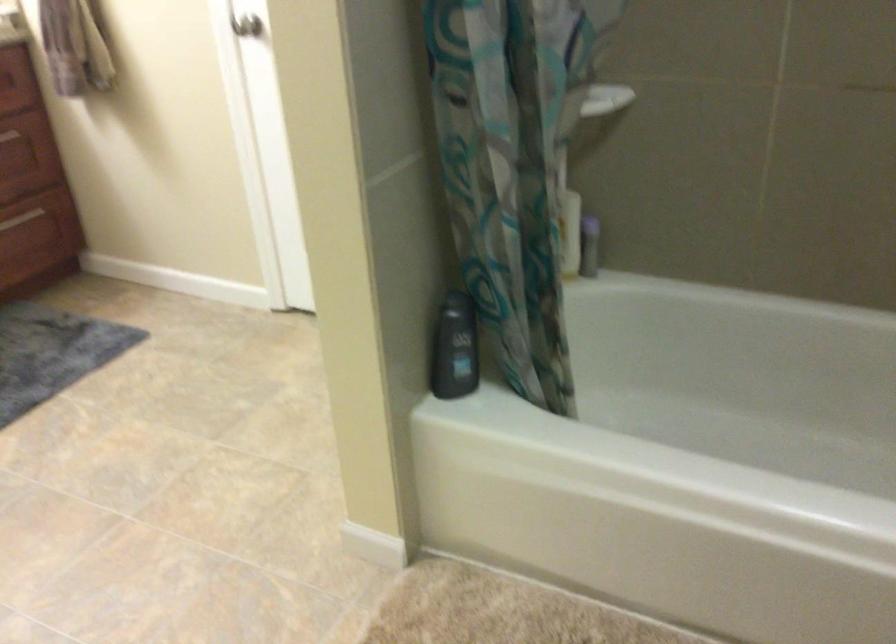
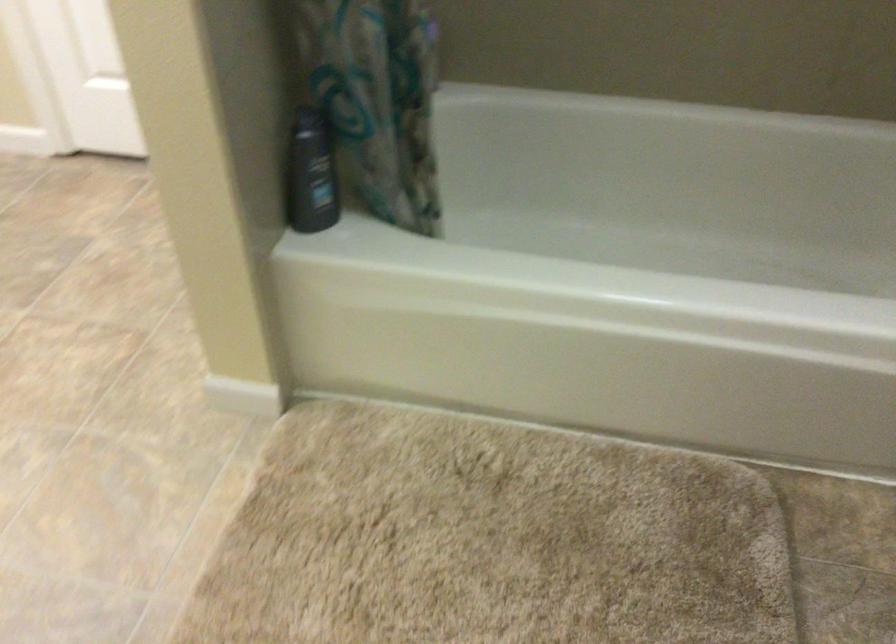
The point at (451,348) is marked in the first image. Where is the corresponding point in the second image?

(311, 174)